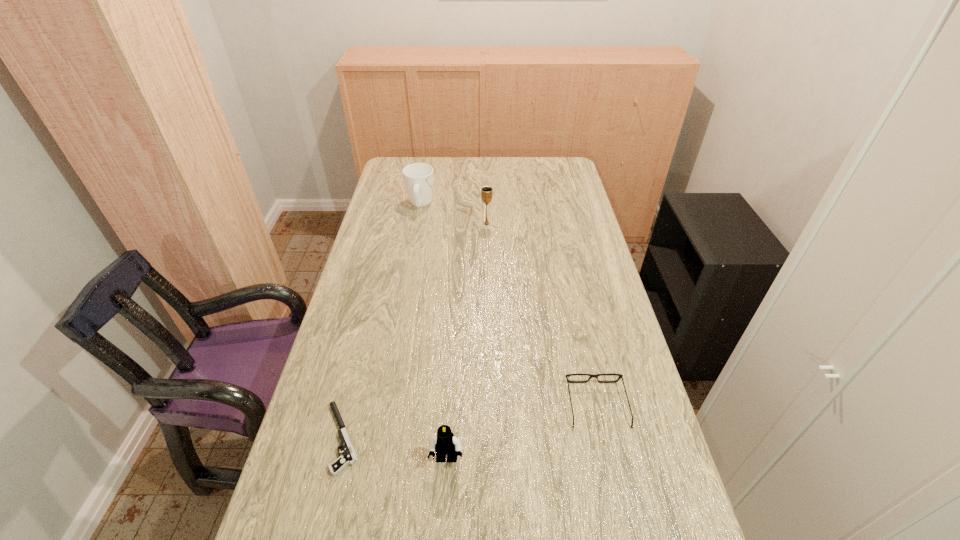
Locate an element on the screen. The height and width of the screenshot is (540, 960). free space that is in between the fourth tallest object and the fourth nearest object is located at coordinates (541, 314).

Where is `unoccupied position between the shortest object and the chalice`? The height and width of the screenshot is (540, 960). unoccupied position between the shortest object and the chalice is located at coordinates (415, 331).

The image size is (960, 540). In order to click on free space that is in between the third tallest object and the fourth nearest object in this screenshot , I will do `click(467, 342)`.

I want to click on the second closest object to the third object from left to right, so click(608, 374).

At what (x,y) coordinates should I click in order to perform the action: click on object that is the fourth closest to the pistol. Please return your answer as a coordinate pair (x, y). This screenshot has height=540, width=960. Looking at the image, I should click on (418, 177).